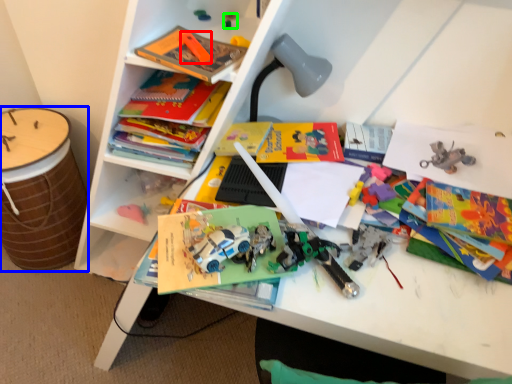
Question: Which object is positioned closest to toy (highlighted by a red box)? Select from drum (highlighted by a blue box) and toy (highlighted by a green box).

Choices:
 (A) drum
 (B) toy

Answer: (B)